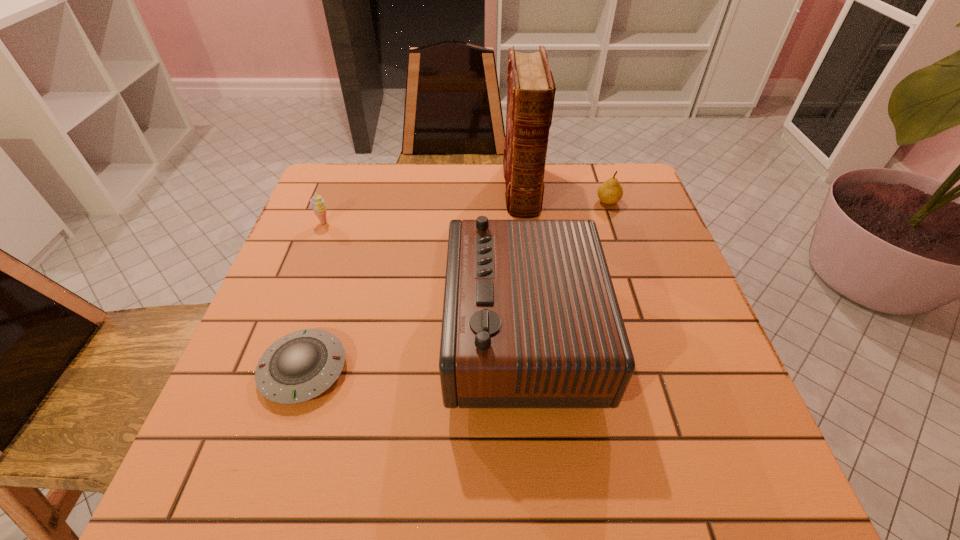
Identify the location of vacant space located on the right of the sherbert. This screenshot has width=960, height=540. (420, 223).

I want to click on vacant space located on the right of the shortest object, so click(x=548, y=369).

Find the location of a particular element. This screenshot has width=960, height=540. hardback book that is at the far edge is located at coordinates (531, 89).

Image resolution: width=960 pixels, height=540 pixels. I want to click on pear located at the far edge, so click(610, 192).

Locate an element on the screen. This screenshot has height=540, width=960. sherbert that is positioned at the left edge is located at coordinates (317, 204).

What are the coordinates of `saucer that is at the left edge` in the screenshot? It's located at (300, 366).

Find the location of a particular element. The height and width of the screenshot is (540, 960). object present at the right edge is located at coordinates (610, 192).

This screenshot has width=960, height=540. What are the coordinates of `object located in the far right corner section of the desktop` in the screenshot? It's located at (610, 192).

The width and height of the screenshot is (960, 540). In order to click on free location at the far edge of the desktop in this screenshot , I will do `click(492, 164)`.

Locate an element on the screen. free region at the near edge is located at coordinates (603, 480).